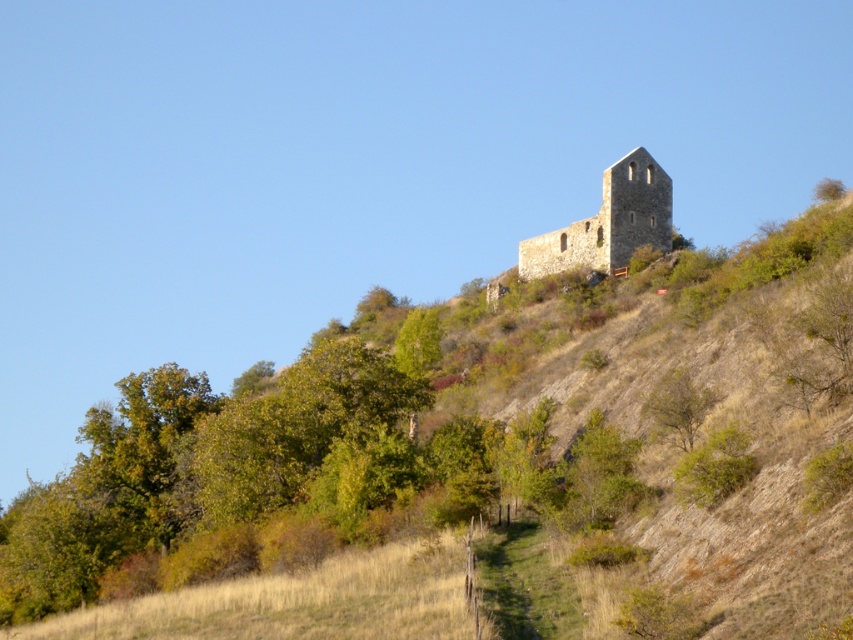
How much distance is there between brown stone ruins at upper center and stone tower at upper right?

The distance of brown stone ruins at upper center from stone tower at upper right is 29.46 meters.

Based on the photo, between brown stone ruins at upper center and stone tower at upper right, which one appears on the right side from the viewer's perspective?

stone tower at upper right

This screenshot has width=853, height=640. What are the coordinates of `brown stone ruins at upper center` in the screenshot? It's located at (479, 458).

Who is positioned more to the left, stone tower at upper right or green leafy tree at center-right?

Positioned to the left is green leafy tree at center-right.

Between point (590, 218) and point (660, 420), which one is positioned behind?

The point (590, 218) is behind.

What are the coordinates of `stone tower at upper right` in the screenshot? It's located at (608, 221).

Describe the element at coordinates (479, 458) in the screenshot. I see `brown stone ruins at upper center` at that location.

Who is more distant from viewer, (381,534) or (660,378)?

Positioned behind is point (660,378).

This screenshot has width=853, height=640. Identify the location of brown stone ruins at upper center. (479, 458).